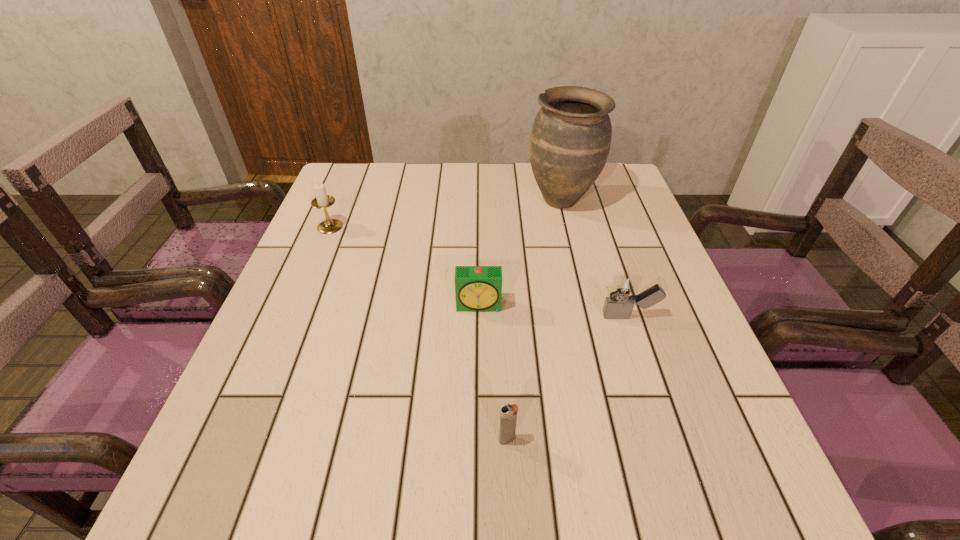
Where is `vacant region located on the front-facing side of the alarm clock`? Image resolution: width=960 pixels, height=540 pixels. vacant region located on the front-facing side of the alarm clock is located at coordinates (480, 360).

This screenshot has width=960, height=540. Find the location of `free space located 0.100m on the right of the nearest object`. free space located 0.100m on the right of the nearest object is located at coordinates (577, 440).

Find the location of `object located in the far edge section of the desktop`. object located in the far edge section of the desktop is located at coordinates (570, 139).

The height and width of the screenshot is (540, 960). In order to click on object at the left edge in this screenshot , I will do pyautogui.click(x=322, y=201).

The height and width of the screenshot is (540, 960). Identify the location of urn that is at the right edge. (570, 139).

Locate an element on the screen. igniter positioned at the right edge is located at coordinates (623, 290).

This screenshot has width=960, height=540. I want to click on object that is at the far right corner, so click(570, 139).

Where is `free location at the far edge`? free location at the far edge is located at coordinates (484, 187).

The image size is (960, 540). Identify the location of vacant space at the near edge of the desktop. (498, 465).

Identify the location of vacant space at the left edge of the desktop. The width and height of the screenshot is (960, 540). (345, 246).